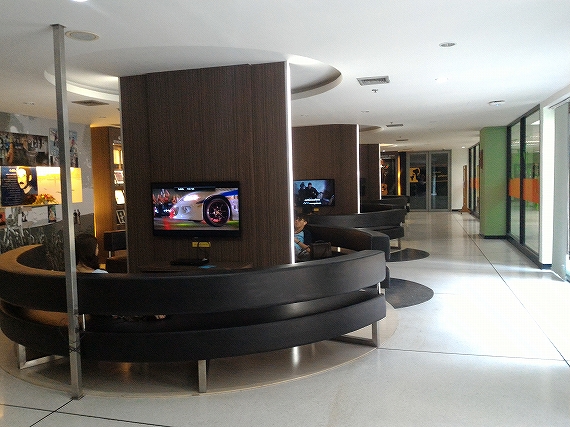
Where is `ceiling lights`? ceiling lights is located at coordinates (306, 61), (462, 148), (112, 80).